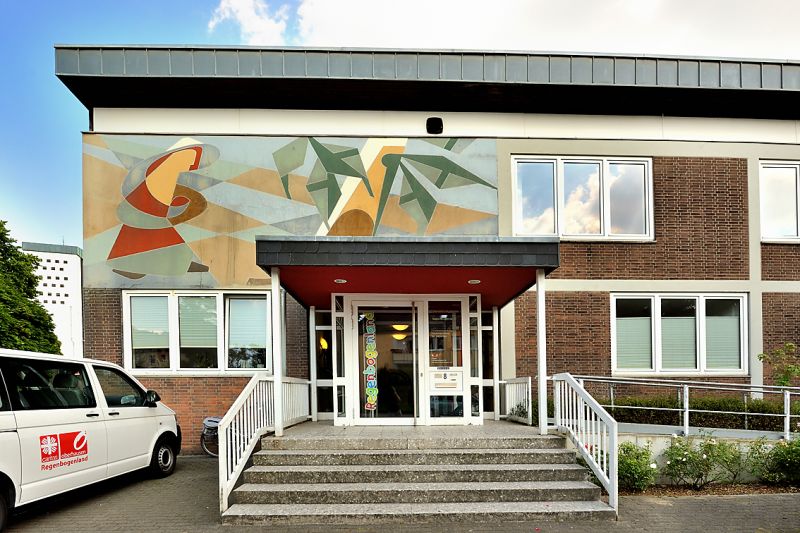
You are a GUI agent. You are given a task and a screenshot of the screen. Output one action in this format:
    pyautogui.click(x=<x>, y=<y>)
    Task: Click on the ground floor window
    The height and width of the screenshot is (533, 800).
    Given the screenshot: What is the action you would take?
    [x=144, y=327], [x=193, y=331], [x=245, y=328], [x=634, y=335], [x=678, y=335], [x=726, y=336]